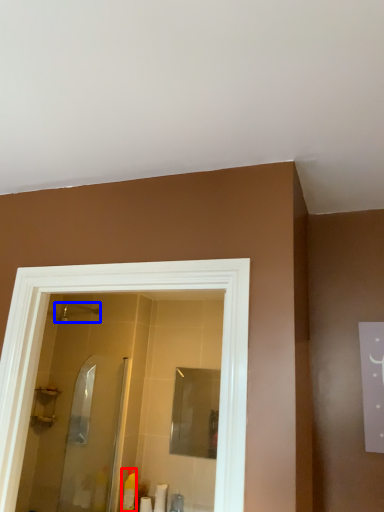
Question: Among these objects, which one is farthest to the camera, toiletry (highlighted by a red box) or shower (highlighted by a blue box)?

Choices:
 (A) toiletry
 (B) shower

Answer: (B)